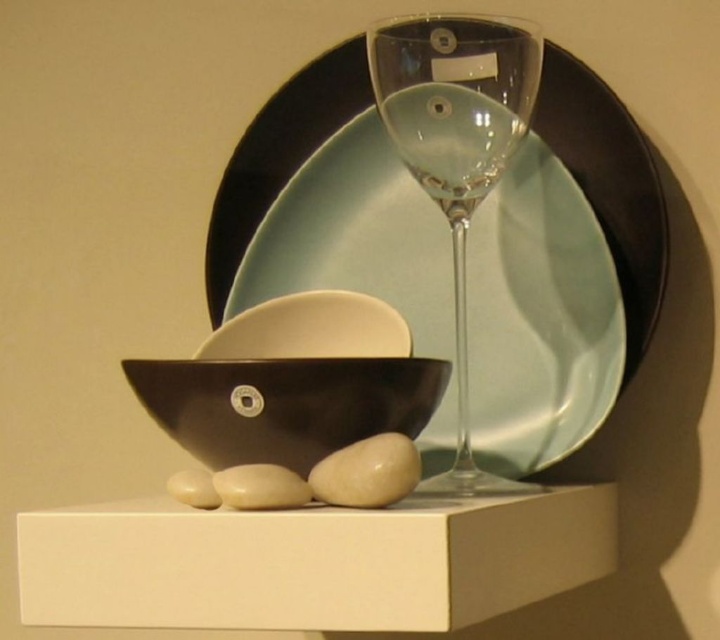
Question: Which object appears closest to the camera in this image?

Choices:
 (A) white smooth stone at lower center
 (B) transparent glass wine glass at center
 (C) matte black bowl at center

Answer: (A)

Question: Does transparent glass wine glass at upper center appear over white smooth stone at lower center?

Choices:
 (A) no
 (B) yes

Answer: (B)

Question: Among these objects, which one is farthest from the camera?

Choices:
 (A) matte black bowl at center
 (B) white matte shelf at center
 (C) white smooth stone at lower center

Answer: (A)

Question: Is transparent glass wine glass at center to the left of white smooth stone at lower center from the viewer's perspective?

Choices:
 (A) no
 (B) yes

Answer: (A)

Question: Which point is farther to the camera?

Choices:
 (A) (253, 490)
 (B) (189, 497)
 (C) (395, 353)
 (D) (472, 60)

Answer: (C)

Question: Does transparent glass wine glass at center have a smaller size compared to smooth beige stone at lower center?

Choices:
 (A) yes
 (B) no

Answer: (B)